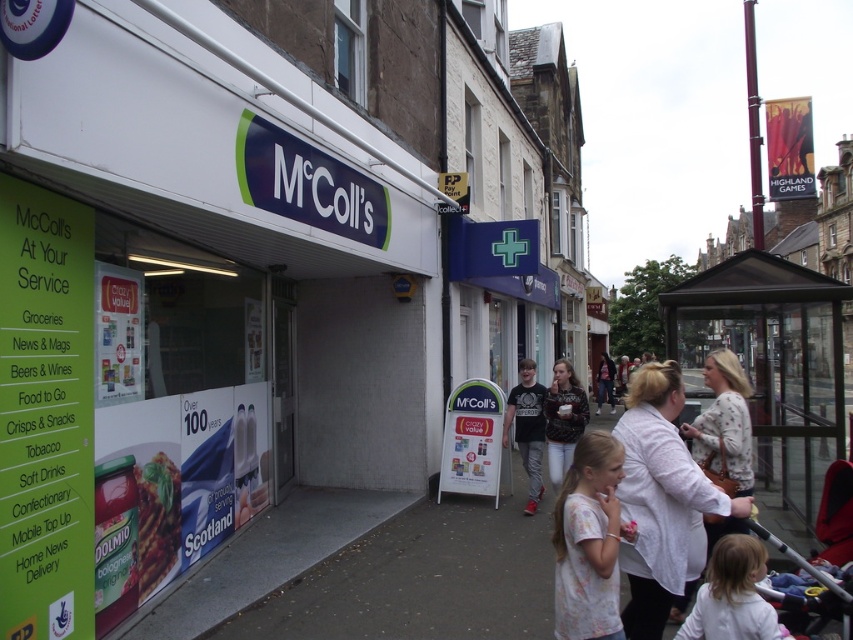
Who is more forward, (132, 282) or (154, 506)?

Point (132, 282) is more forward.

Is white matte signboard at center closer to camera compared to matte plastic baguette at lower left?

Yes, it is in front of matte plastic baguette at lower left.

This screenshot has width=853, height=640. I want to click on white matte signboard at center, so click(210, 259).

Which of these two, white matte signboard at center or light pink cotton shirt at lower center, stands shorter?

white matte signboard at center is shorter.

Can you confirm if white matte signboard at center is positioned below light pink cotton shirt at lower center?

No.

You are a GUI agent. You are given a task and a screenshot of the screen. Output one action in this format:
    pyautogui.click(x=<x>, y=<y>)
    Task: Click on the white matte signboard at center
    This screenshot has width=853, height=640.
    Given the screenshot: What is the action you would take?
    pyautogui.click(x=210, y=259)

Where is `white matte signboard at center`? The height and width of the screenshot is (640, 853). white matte signboard at center is located at coordinates (210, 259).

Which of these two, metallic silver baby carriage at lower right or fluffy sweater at center, stands shorter?

metallic silver baby carriage at lower right

This screenshot has width=853, height=640. Find the location of `metallic silver baby carriage at lower right`. metallic silver baby carriage at lower right is located at coordinates (820, 560).

This screenshot has height=640, width=853. I want to click on metallic silver baby carriage at lower right, so click(x=820, y=560).